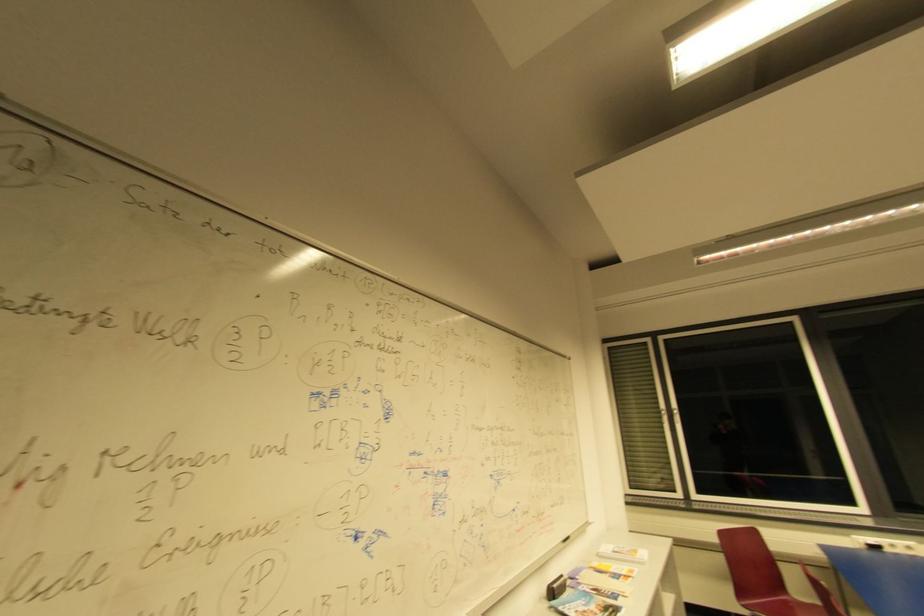
You are a GUI agent. You are given a task and a screenshot of the screen. Output one action in this format:
    pyautogui.click(x=<x>, y=<y>)
    Task: Click on the white window handle
    The image size is (924, 616).
    Given the screenshot: What is the action you would take?
    [678, 432]